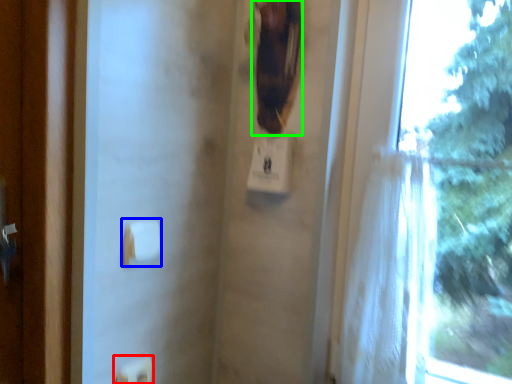
Question: Considering the real-world distances, which object is closest to light switch (highlighted by a red box)? towel bar (highlighted by a blue box) or animal (highlighted by a green box).

Choices:
 (A) towel bar
 (B) animal

Answer: (A)